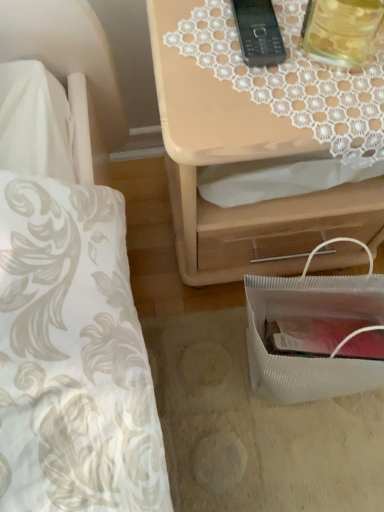
At what (x,y) coordinates should I click in order to perform the action: click on unoccupied area in front of black plastic phone at upper center. Please return your answer as a coordinate pair (x, y). This screenshot has width=384, height=512. Looking at the image, I should click on (263, 98).